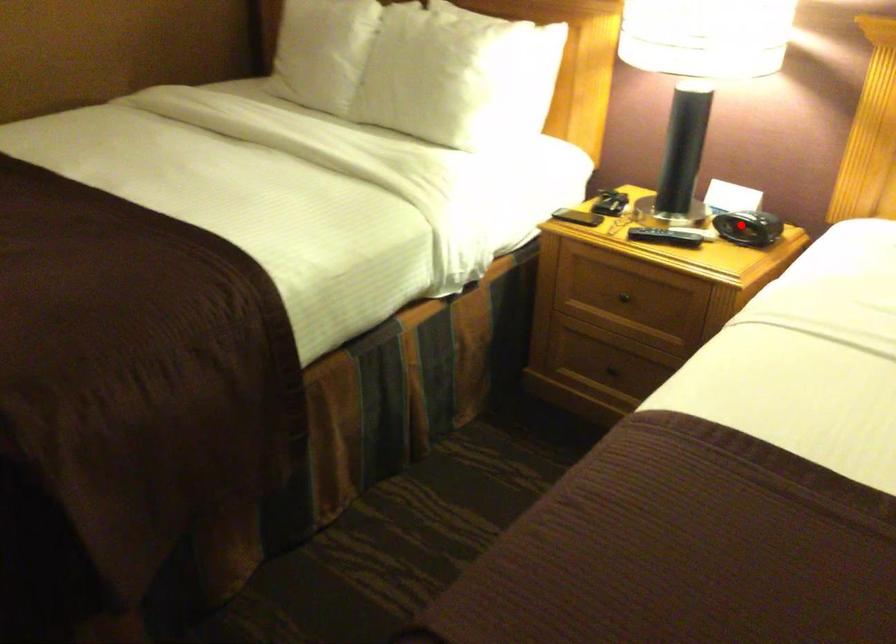
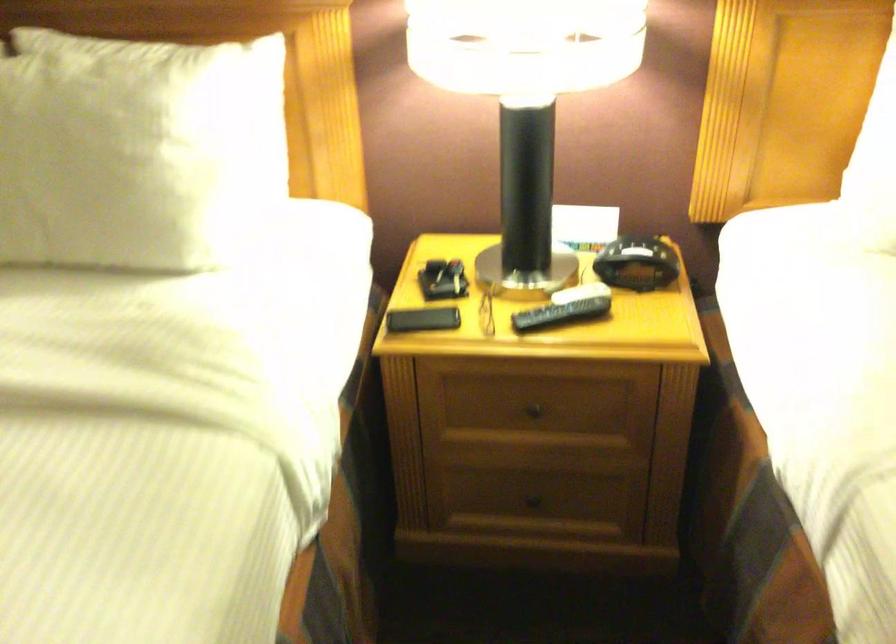
Locate, in the second image, the point that corresponds to the highlighted location in the first image.

(636, 263)